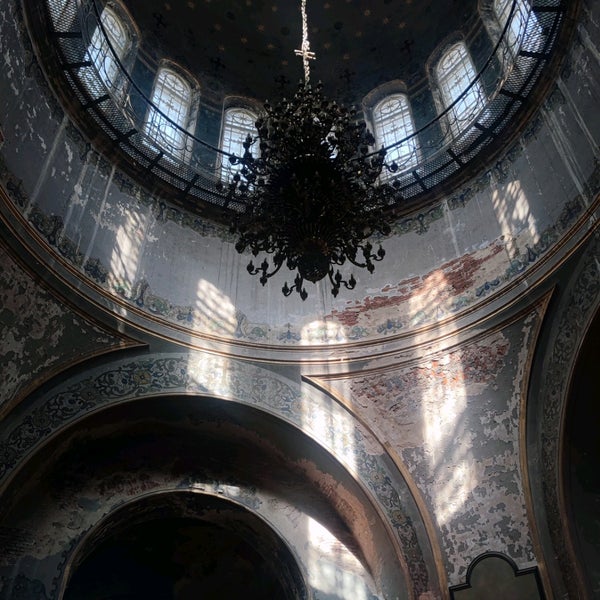
The image size is (600, 600). Identify the location of archway. (207, 542), (584, 437).